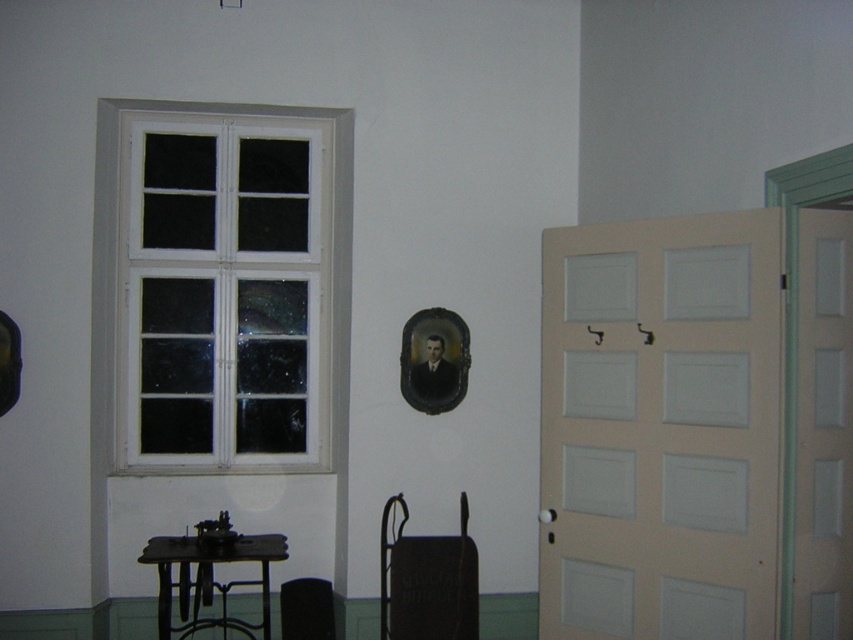
Question: Is white matte door at right wider than matte black chair at lower center?

Choices:
 (A) no
 (B) yes

Answer: (B)

Question: Can you confirm if white wooden window at upper left is positioned above matte black chair at lower center?

Choices:
 (A) no
 (B) yes

Answer: (B)

Question: Which object appears closest to the camera in this image?

Choices:
 (A) metallic black table at lower left
 (B) white wooden window at upper left
 (C) white matte door at right

Answer: (C)

Question: Can you confirm if white matte door at right is bigger than white wooden window at upper left?

Choices:
 (A) yes
 (B) no

Answer: (A)

Question: Considering the real-world distances, which object is closest to the metallic black table at lower left?

Choices:
 (A) matte black chair at lower center
 (B) white wooden window at upper left

Answer: (B)

Question: Which point is closer to the camera?

Choices:
 (A) metallic black table at lower left
 (B) white wooden window at upper left

Answer: (A)